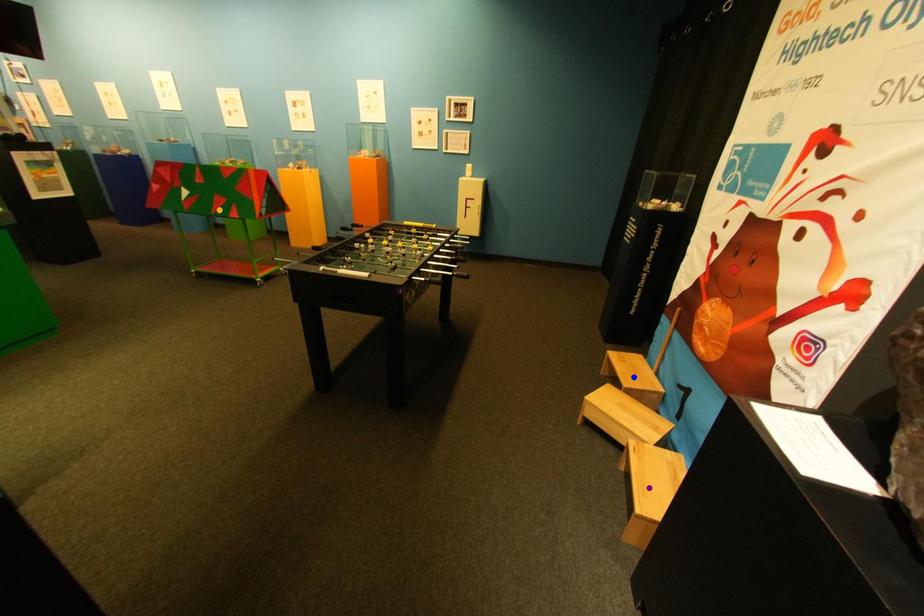
Order these from nearest to farthest:
- blue point
- orange point
- purple point

orange point, blue point, purple point